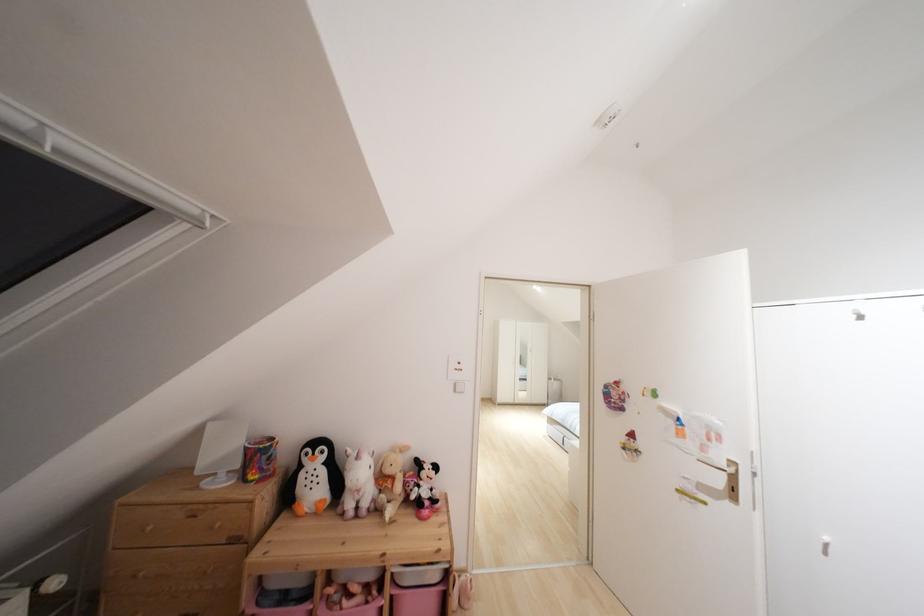
This screenshot has width=924, height=616. What do you see at coordinates (259, 459) in the screenshot? I see `the colorful pencil cup` at bounding box center [259, 459].